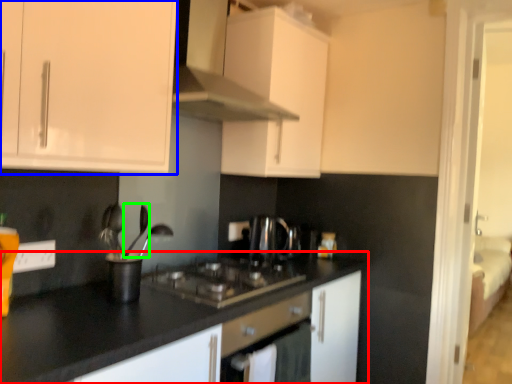
Question: Estimate the real-world distances between objects in this image. Which object is closer to countertop (highlighted by a red box), cabinetry (highlighted by a blue box) or silverware (highlighted by a green box)?

Choices:
 (A) cabinetry
 (B) silverware

Answer: (B)